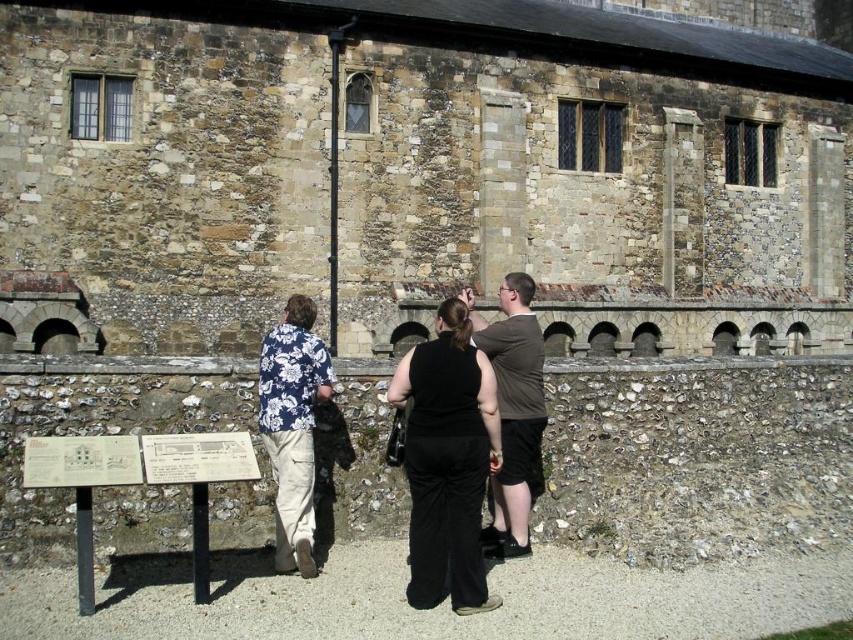
You are standing in front of a historical building and want to take a photo of the point at coordinates point (653, 323). If you are currently 151.91 feet away from it, is this distance suitable for capturing the entire structure in your camera frame?

The point (653, 323) is 151.91 feet away from the viewer. This distance may be too far to capture the entire historical building in a single camera frame, as most cameras require closer proximity to include all architectural details in one shot.

You are a tour guide explaining the historical significance of the stone wall at center and the black matte pants at center to your group. Which object is bigger in size?

The stone wall at center has a larger size compared to the black matte pants at center.